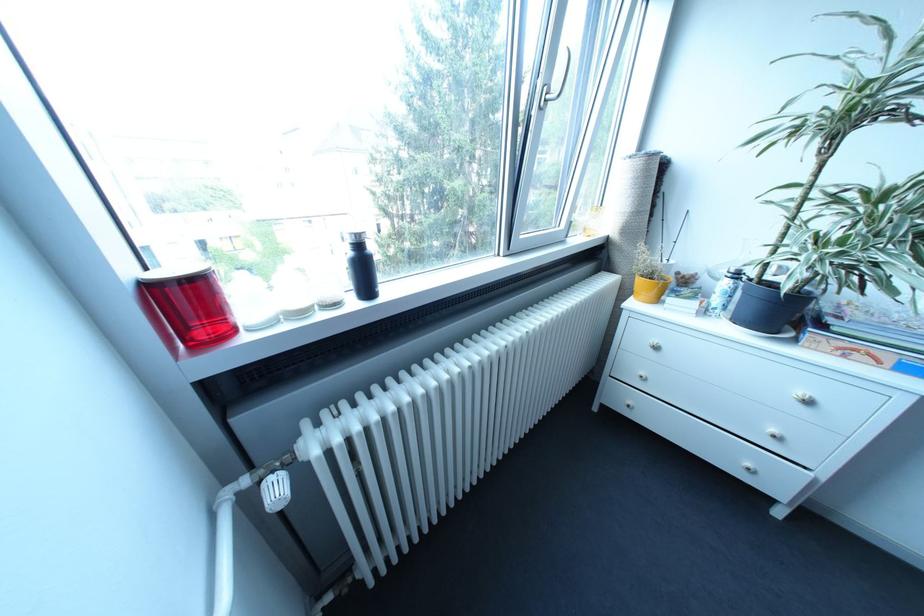
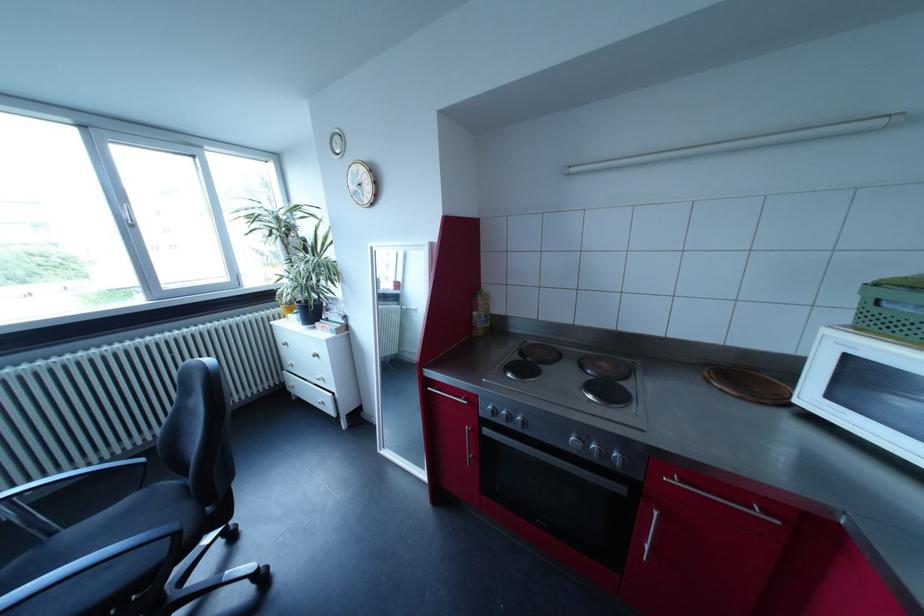
In a continuous first-person perspective shot, in which direction is the camera moving?

The movement direction of the cameraman is right, backward.